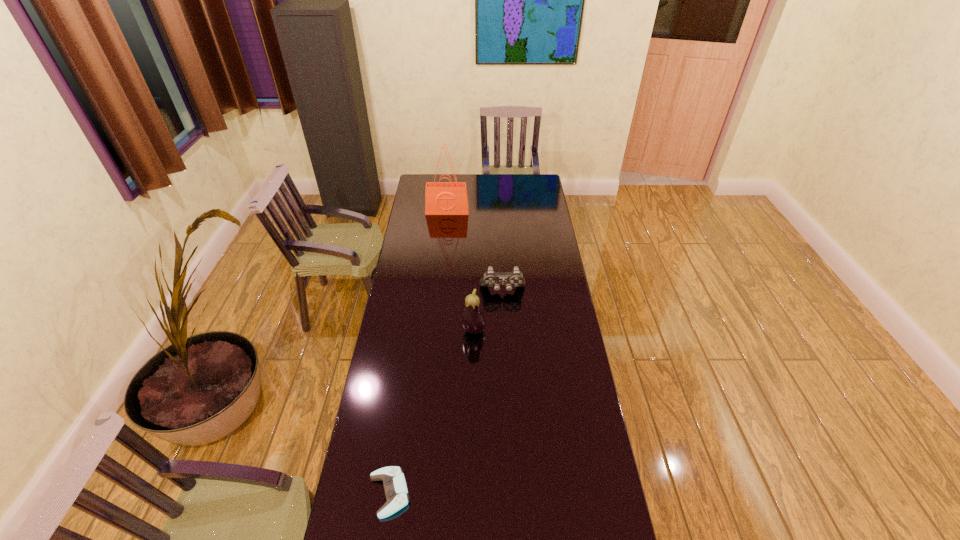
Find the location of `tote bag`. tote bag is located at coordinates (441, 198).

Find the location of a particular element. This screenshot has height=540, width=960. the farthest object is located at coordinates (441, 198).

The image size is (960, 540). Identify the location of eggplant. (473, 321).

At what (x,y) coordinates should I click in order to perform the action: click on the third farthest object. Please return your answer as a coordinate pair (x, y). Image resolution: width=960 pixels, height=540 pixels. Looking at the image, I should click on (473, 321).

The image size is (960, 540). Identify the location of the right control. (515, 278).

Find the location of `the taller control`. the taller control is located at coordinates (515, 278).

Find the location of a particular element. the left control is located at coordinates (395, 487).

This screenshot has width=960, height=540. Find the location of `the nearest object`. the nearest object is located at coordinates click(395, 487).

Where is `vacant space located 0.250m on the logo side of the tote bag`? This screenshot has width=960, height=540. vacant space located 0.250m on the logo side of the tote bag is located at coordinates (444, 242).

Where is `free spot located 0.150m on the right of the eggplant`? free spot located 0.150m on the right of the eggplant is located at coordinates [x=521, y=330].